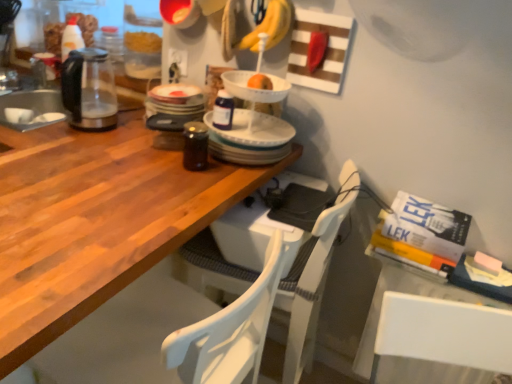
This screenshot has width=512, height=384. Find the location of `vacant space underneath transparent glass kettle at left (from a real-world perspective)`. vacant space underneath transparent glass kettle at left (from a real-world perspective) is located at coordinates (89, 126).